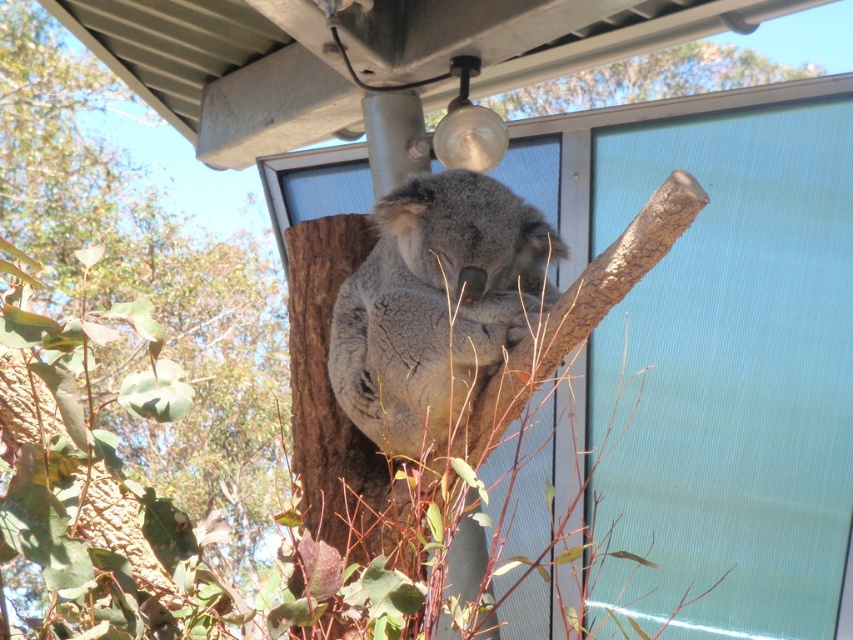
Question: Is gray furry koala at center positioned at the back of brown rough bark at upper center?

Choices:
 (A) yes
 (B) no

Answer: (B)

Question: Is brown rough bark tree at center closer to the viewer compared to brown rough bark at upper center?

Choices:
 (A) no
 (B) yes

Answer: (A)

Question: Does gray furry koala at center appear on the left side of brown rough bark at upper center?

Choices:
 (A) yes
 (B) no

Answer: (A)

Question: Which object is positioned farthest from the brown rough bark at upper center?

Choices:
 (A) gray furry koala at center
 (B) brown rough bark tree at center

Answer: (B)

Question: Which of the following is the farthest from the observer?

Choices:
 (A) brown rough bark tree at center
 (B) gray furry koala at center
 (C) brown rough bark at upper center

Answer: (A)

Question: Which object appears farthest from the camera in this image?

Choices:
 (A) brown rough bark at upper center
 (B) brown rough bark tree at center

Answer: (B)